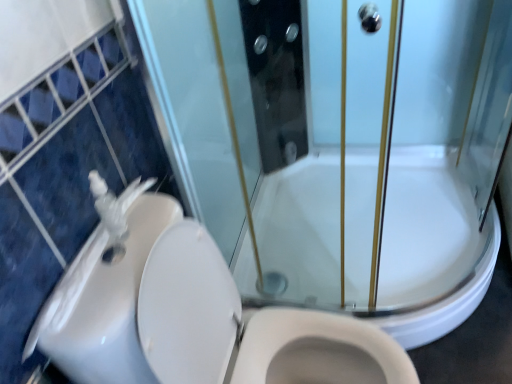
What do you see at coordinates (105, 290) in the screenshot? The height and width of the screenshot is (384, 512). I see `white glossy sink at left` at bounding box center [105, 290].

Where is `white glossy sink at left`? The height and width of the screenshot is (384, 512). white glossy sink at left is located at coordinates (105, 290).

From the image's perspective, who appears lower, white glossy sink at left or white glossy toilet at lower left?

From the image's view, white glossy toilet at lower left is below.

Which is closer to the camera, (62, 306) or (207, 357)?

Point (62, 306) appears to be closer to the viewer than point (207, 357).

Is white glossy toilet at lower left a part of white glossy sink at left?

No, white glossy sink at left does not contain white glossy toilet at lower left.

Locate an element on the screen. toilet in front of the white glossy sink at left is located at coordinates (176, 308).

In the scene shown: Is white glossy bath at center turned away from white glossy toilet at lower left?

No, white glossy toilet at lower left is not at the back of white glossy bath at center.

I want to click on bath above the white glossy toilet at lower left (from the image's perspective), so click(431, 248).

From the image's perspective, is white glossy bath at center below white glossy toilet at lower left?

No, from the image's perspective, white glossy bath at center is not beneath white glossy toilet at lower left.

Does white glossy bath at center have a greater height compared to white glossy toilet at lower left?

In fact, white glossy bath at center may be shorter than white glossy toilet at lower left.

Which is behind, white glossy toilet at lower left or white glossy sink at left?

white glossy sink at left is further from the camera.

From a real-world perspective, which object stands above the other?

white glossy sink at left.

Is white glossy toilet at lower left looking in the opposite direction of white glossy sink at left?

Yes.

Who is smaller, white glossy toilet at lower left or white glossy sink at left?

white glossy sink at left.

How different are the orientations of white glossy bath at center and white glossy sink at left in degrees?

The angular difference between white glossy bath at center and white glossy sink at left is 91.1 degrees.

Is white glossy bath at center placed right next to white glossy sink at left?

They are not placed beside each other.

Measure the distance from white glossy bath at center to white glossy sink at left.

white glossy bath at center and white glossy sink at left are 37.02 inches apart from each other.

Is white glossy sink at left at the back of white glossy bath at center?

white glossy bath at center does not have its back to white glossy sink at left.

Where is `sink that is above the white glossy bath at center (from a real-world perspective)`? sink that is above the white glossy bath at center (from a real-world perspective) is located at coordinates (105, 290).

From the image's perspective, would you say white glossy sink at left is positioned over white glossy bath at center?

Correct, white glossy sink at left appears higher than white glossy bath at center in the image.

Are white glossy sink at left and white glossy bath at center making contact?

No, white glossy sink at left is not in contact with white glossy bath at center.

Measure the distance between white glossy sink at left and white glossy bath at center.

37.02 inches.

From the image's perspective, is white glossy toilet at lower left above white glossy bath at center?

Actually, white glossy toilet at lower left appears below white glossy bath at center in the image.

From a real-world perspective, is white glossy toilet at lower left physically above white glossy bath at center?

Yes.

Which is farther from the camera, [139,298] or [337,213]?

The point [337,213] is farther.

Is white glossy toilet at lower left in contact with white glossy bath at center?

white glossy toilet at lower left and white glossy bath at center are clearly separated.

Find the location of `sink on the left of white glossy toilet at lower left`. sink on the left of white glossy toilet at lower left is located at coordinates (105, 290).

Where is `bath that appears on the right of white glossy toilet at lower left`? This screenshot has height=384, width=512. bath that appears on the right of white glossy toilet at lower left is located at coordinates (431, 248).

Which object lies nearer to the anchor point white glossy sink at left, white glossy toilet at lower left or white glossy bath at center?

Among the two, white glossy toilet at lower left is located nearer to white glossy sink at left.

From the image, which object appears to be farther from white glossy bath at center, white glossy sink at left or white glossy toilet at lower left?

Based on the image, white glossy sink at left appears to be further to white glossy bath at center.

Looking at the image, which one is located further to white glossy sink at left, white glossy bath at center or white glossy toilet at lower left?

Based on the image, white glossy bath at center appears to be further to white glossy sink at left.

Considering their positions, is white glossy toilet at lower left positioned further to white glossy bath at center than white glossy sink at left?

white glossy sink at left.

Considering their positions, is white glossy bath at center positioned further to white glossy toilet at lower left than white glossy sink at left?

Based on the image, white glossy bath at center appears to be further to white glossy toilet at lower left.

From the image, which object appears to be nearer to white glossy toilet at lower left, white glossy sink at left or white glossy bath at center?

white glossy sink at left is closer to white glossy toilet at lower left.

You are a GUI agent. You are given a task and a screenshot of the screen. Output one action in this format:
    pyautogui.click(x=<x>, y=<y>)
    Task: Click on the toilet situated between white glossy sink at left and white glossy bath at center from left to right
    Image resolution: width=512 pixels, height=384 pixels.
    Given the screenshot: What is the action you would take?
    pyautogui.click(x=176, y=308)